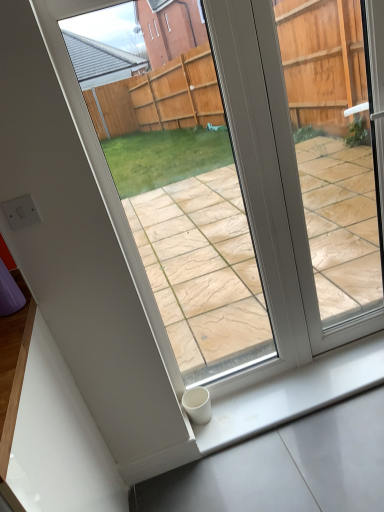
Question: Is white glossy window sill at lower right behind transparent glass door at center?

Choices:
 (A) no
 (B) yes

Answer: (B)

Question: From a real-world perspective, is white glossy window sill at lower right located higher than transparent glass door at center?

Choices:
 (A) yes
 (B) no

Answer: (B)

Question: Is white glossy window sill at lower right beside transparent glass door at center?

Choices:
 (A) yes
 (B) no

Answer: (B)

Question: Can you confirm if white glossy window sill at lower right is wider than transparent glass door at center?

Choices:
 (A) yes
 (B) no

Answer: (A)

Question: Is white glossy window sill at lower right bigger than transparent glass door at center?

Choices:
 (A) no
 (B) yes

Answer: (A)

Question: Can you confirm if white glossy window sill at lower right is thinner than transparent glass door at center?

Choices:
 (A) yes
 (B) no

Answer: (B)

Question: Does transparent glass door at center have a larger size compared to white glossy window sill at lower right?

Choices:
 (A) yes
 (B) no

Answer: (A)

Question: From the image's perspective, is transparent glass door at center on white glossy window sill at lower right?

Choices:
 (A) yes
 (B) no

Answer: (A)

Question: Can you confirm if transparent glass door at center is smaller than white glossy window sill at lower right?

Choices:
 (A) no
 (B) yes

Answer: (A)

Question: Would you say transparent glass door at center is outside white glossy window sill at lower right?

Choices:
 (A) yes
 (B) no

Answer: (A)

Question: From a real-world perspective, is transparent glass door at center positioned over white glossy window sill at lower right based on gravity?

Choices:
 (A) no
 (B) yes

Answer: (B)

Question: Is transparent glass door at center further to camera compared to white glossy window sill at lower right?

Choices:
 (A) no
 (B) yes

Answer: (A)

Question: From their relative heights in the image, would you say transparent glass door at center is taller or shorter than white glossy window sill at lower right?

Choices:
 (A) tall
 (B) short

Answer: (A)